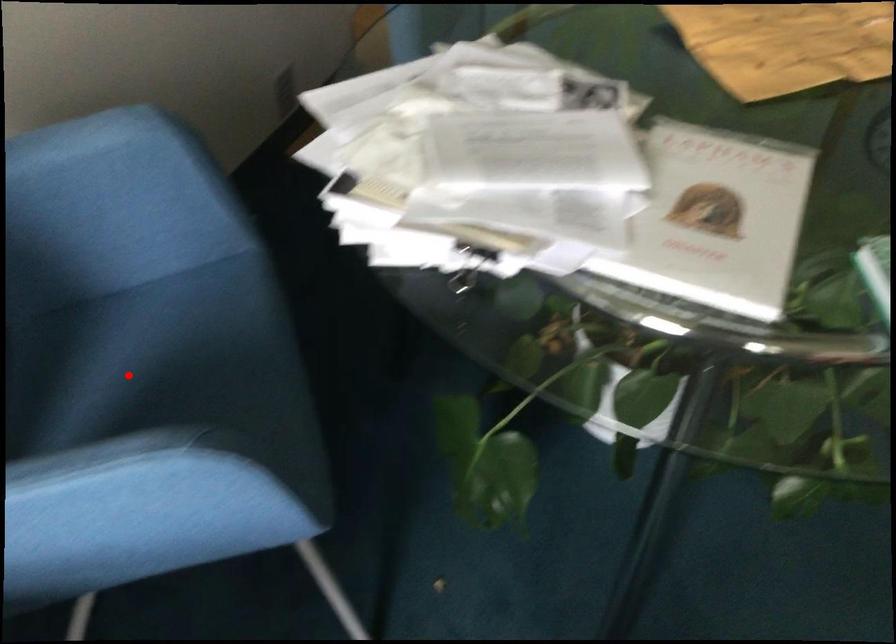
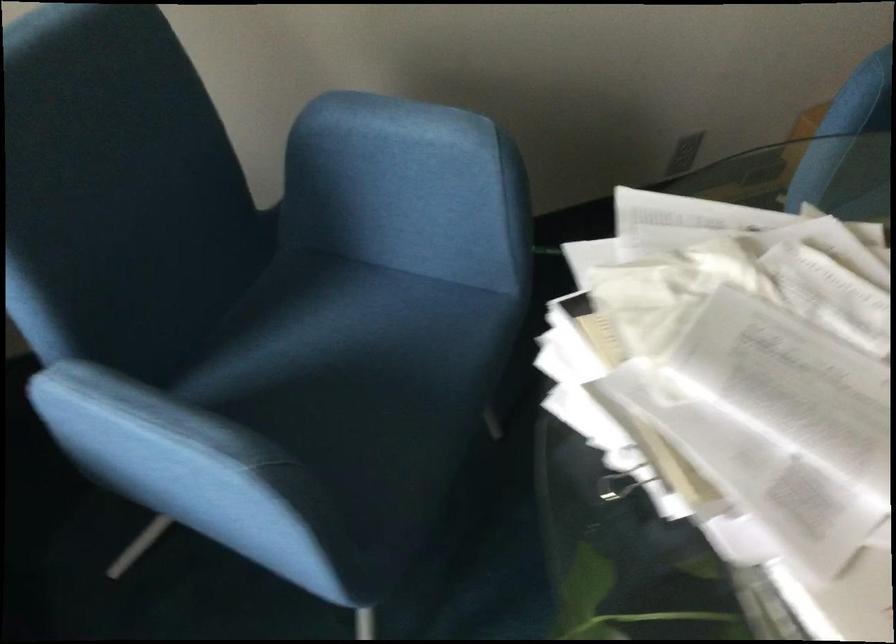
Locate, in the second image, the point that corresponds to the highlighted location in the first image.

(328, 342)